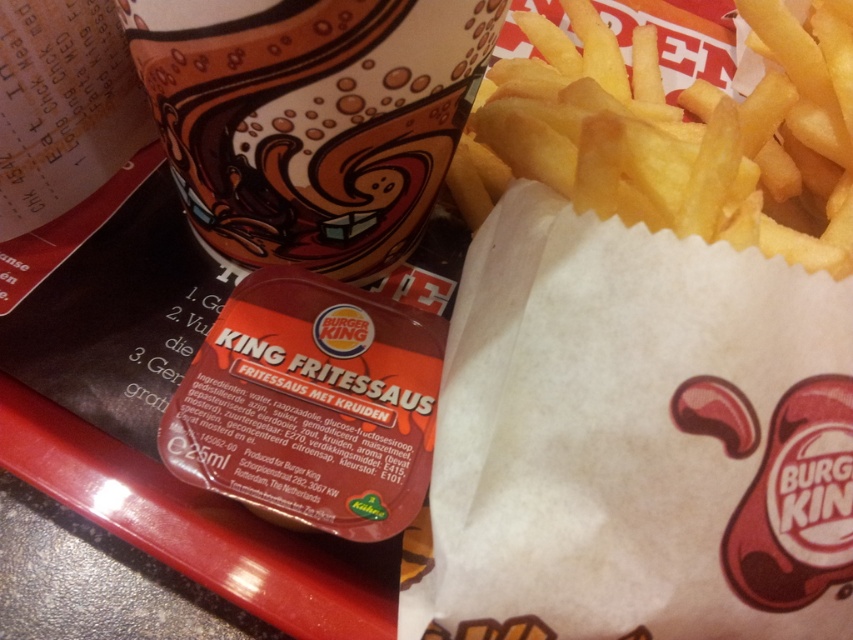
Question: Can you confirm if matte ceramic cup at upper center is bigger than golden crispy french fries at upper right?

Choices:
 (A) yes
 (B) no

Answer: (B)

Question: Which point is farther to the camera?

Choices:
 (A) matte ceramic cup at upper center
 (B) golden crispy french fries at upper right

Answer: (B)

Question: Which point is farther to the camera?

Choices:
 (A) golden crispy french fries at upper right
 (B) matte ceramic cup at upper center

Answer: (A)

Question: Does matte ceramic cup at upper center appear over golden crispy french fries at upper right?

Choices:
 (A) yes
 (B) no

Answer: (B)

Question: Which of the following is the closest to the observer?

Choices:
 (A) (374, 227)
 (B) (598, 170)

Answer: (B)

Question: Is matte ceramic cup at upper center positioned before golden crispy french fries at upper right?

Choices:
 (A) no
 (B) yes

Answer: (B)